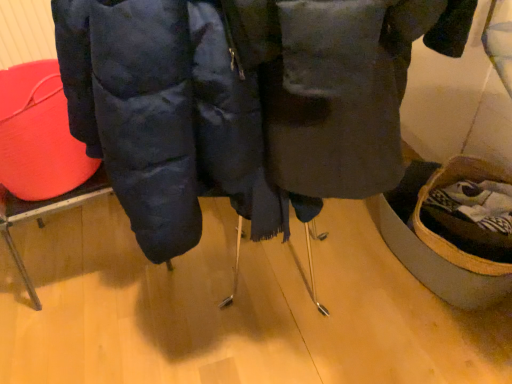
Locate an element on the screen. This screenshot has height=384, width=512. matte blue jacket at center is located at coordinates (243, 102).

What do you see at coordinates (243, 102) in the screenshot?
I see `matte blue jacket at center` at bounding box center [243, 102].

The image size is (512, 384). What do you see at coordinates (38, 134) in the screenshot?
I see `rubberized red bucket at left` at bounding box center [38, 134].

Measure the distance between point (71, 143) and camera.

Point (71, 143) and camera are 1.23 meters apart from each other.

I want to click on rubberized red bucket at left, so click(38, 134).

Locate an element on the screen. Image resolution: width=512 pixels, height=384 pixels. matte blue jacket at center is located at coordinates (243, 102).

Which object is positioned more to the right, matte blue jacket at center or rubberized red bucket at left?

matte blue jacket at center.

Is matte blue jacket at center in front of or behind rubberized red bucket at left in the image?

matte blue jacket at center is positioned closer to the viewer than rubberized red bucket at left.

Does point (106, 148) lie in front of point (61, 130)?

Yes, it is.

From the image's perspective, between matte blue jacket at center and rubberized red bucket at left, who is located below?

matte blue jacket at center, from the image's perspective.

From a real-world perspective, who is located higher, matte blue jacket at center or rubberized red bucket at left?

In real-world perspective, matte blue jacket at center is above.

Considering the relative sizes of matte blue jacket at center and rubberized red bucket at left in the image provided, is matte blue jacket at center thinner than rubberized red bucket at left?

No.

Consider the image. Considering the relative sizes of matte blue jacket at center and rubberized red bucket at left in the image provided, is matte blue jacket at center shorter than rubberized red bucket at left?

In fact, matte blue jacket at center may be taller than rubberized red bucket at left.

Between matte blue jacket at center and rubberized red bucket at left, which one has larger size?

With larger size is matte blue jacket at center.

Is matte blue jacket at center outside of rubberized red bucket at left?

Yes, matte blue jacket at center is outside of rubberized red bucket at left.

Is matte blue jacket at center in contact with rubberized red bucket at left?

They are not placed beside each other.

Is rubberized red bucket at left at the back of matte blue jacket at center?

No, matte blue jacket at center's orientation is not away from rubberized red bucket at left.

The image size is (512, 384). I want to click on basket on the left of the matte blue jacket at center, so click(38, 134).

In the image, is rubberized red bucket at left on the left side or the right side of matte blue jacket at center?

From the image, it's evident that rubberized red bucket at left is to the left of matte blue jacket at center.

Is rubberized red bucket at left positioned before matte blue jacket at center?

No, it is behind matte blue jacket at center.

Which is nearer, (60,156) or (377,89)?

A: Point (60,156) is farther from the camera than point (377,89).

From the image's perspective, which one is positioned higher, rubberized red bucket at left or matte blue jacket at center?

rubberized red bucket at left, from the image's perspective.

From a real-world perspective, is rubberized red bucket at left positioned under matte blue jacket at center based on gravity?

Yes, from a real-world perspective, rubberized red bucket at left is under matte blue jacket at center.

Which object is thinner, rubberized red bucket at left or matte blue jacket at center?

Thinner between the two is rubberized red bucket at left.

In terms of height, does rubberized red bucket at left look taller or shorter compared to matte blue jacket at center?

In the image, rubberized red bucket at left appears to be shorter than matte blue jacket at center.

Considering the relative sizes of rubberized red bucket at left and matte blue jacket at center in the image provided, is rubberized red bucket at left smaller than matte blue jacket at center?

Indeed, rubberized red bucket at left has a smaller size compared to matte blue jacket at center.

Would you say rubberized red bucket at left is outside matte blue jacket at center?

Indeed, rubberized red bucket at left is completely outside matte blue jacket at center.

Is rubberized red bucket at left not near matte blue jacket at center?

That's not correct — rubberized red bucket at left is a little close to matte blue jacket at center.

Could you tell me if rubberized red bucket at left is facing matte blue jacket at center?

No, rubberized red bucket at left does not turn towards matte blue jacket at center.

The width and height of the screenshot is (512, 384). What are the coordinates of `jacket below the rubberized red bucket at left (from the image's perspective)` in the screenshot? It's located at (243, 102).

At what (x,y) coordinates should I click in order to perform the action: click on basket that appears behind the matte blue jacket at center. Please return your answer as a coordinate pair (x, y). This screenshot has width=512, height=384. Looking at the image, I should click on (38, 134).

Image resolution: width=512 pixels, height=384 pixels. What are the coordinates of `jacket in front of the rubberized red bucket at left` in the screenshot? It's located at (243, 102).